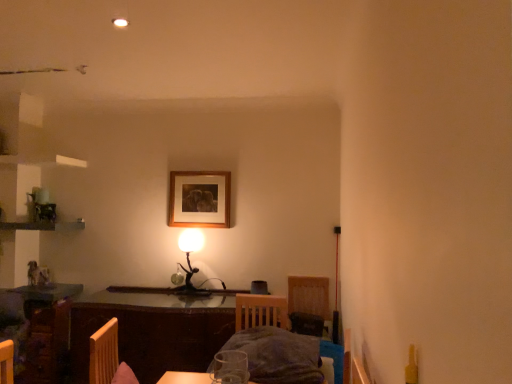
Question: Considering the relative sizes of metallic gold table lamp at center and wooden picture frame at upper center in the image provided, is metallic gold table lamp at center thinner than wooden picture frame at upper center?

Choices:
 (A) no
 (B) yes

Answer: (A)

Question: Is metallic gold table lamp at center to the right of wooden picture frame at upper center from the viewer's perspective?

Choices:
 (A) yes
 (B) no

Answer: (B)

Question: Does metallic gold table lamp at center have a greater width compared to wooden picture frame at upper center?

Choices:
 (A) yes
 (B) no

Answer: (A)

Question: Is metallic gold table lamp at center taller than wooden picture frame at upper center?

Choices:
 (A) yes
 (B) no

Answer: (A)

Question: From the image's perspective, does metallic gold table lamp at center appear lower than wooden picture frame at upper center?

Choices:
 (A) no
 (B) yes

Answer: (B)

Question: Is wooden picture frame at upper center taller or shorter than metallic gold table lamp at center?

Choices:
 (A) short
 (B) tall

Answer: (A)

Question: From the image's perspective, is wooden picture frame at upper center positioned above or below metallic gold table lamp at center?

Choices:
 (A) above
 (B) below

Answer: (A)

Question: Is wooden picture frame at upper center situated inside metallic gold table lamp at center or outside?

Choices:
 (A) outside
 (B) inside

Answer: (A)

Question: Considering the positions of wooden picture frame at upper center and metallic gold table lamp at center in the image, is wooden picture frame at upper center wider or thinner than metallic gold table lamp at center?

Choices:
 (A) wide
 (B) thin

Answer: (B)

Question: Does point (190, 240) appear closer or farther from the camera than point (283, 311)?

Choices:
 (A) farther
 (B) closer

Answer: (A)

Question: From a real-world perspective, relative to dark gray fabric bed at center, is metallic gold table lamp at center vertically above or below?

Choices:
 (A) below
 (B) above

Answer: (B)

Question: Is metallic gold table lamp at center spatially inside dark gray fabric bed at center, or outside of it?

Choices:
 (A) outside
 (B) inside

Answer: (A)

Question: Is metallic gold table lamp at center in front of or behind dark gray fabric bed at center in the image?

Choices:
 (A) behind
 (B) front

Answer: (A)

Question: Relative to wooden picture frame at upper center, is dark gray fabric bed at center in front or behind?

Choices:
 (A) behind
 (B) front

Answer: (B)

Question: From a real-world perspective, relative to wooden picture frame at upper center, is dark gray fabric bed at center vertically above or below?

Choices:
 (A) below
 (B) above

Answer: (A)